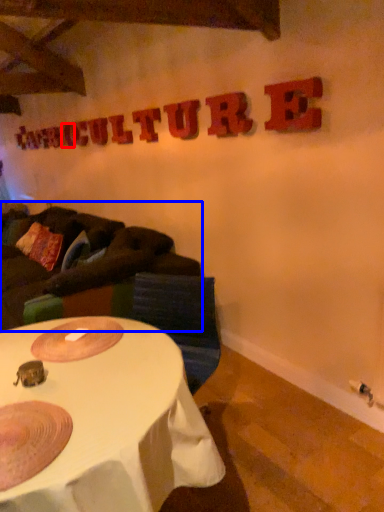
Question: Which object is closer to the camera taking this photo, letter (highlighted by a red box) or studio couch (highlighted by a blue box)?

Choices:
 (A) letter
 (B) studio couch

Answer: (B)